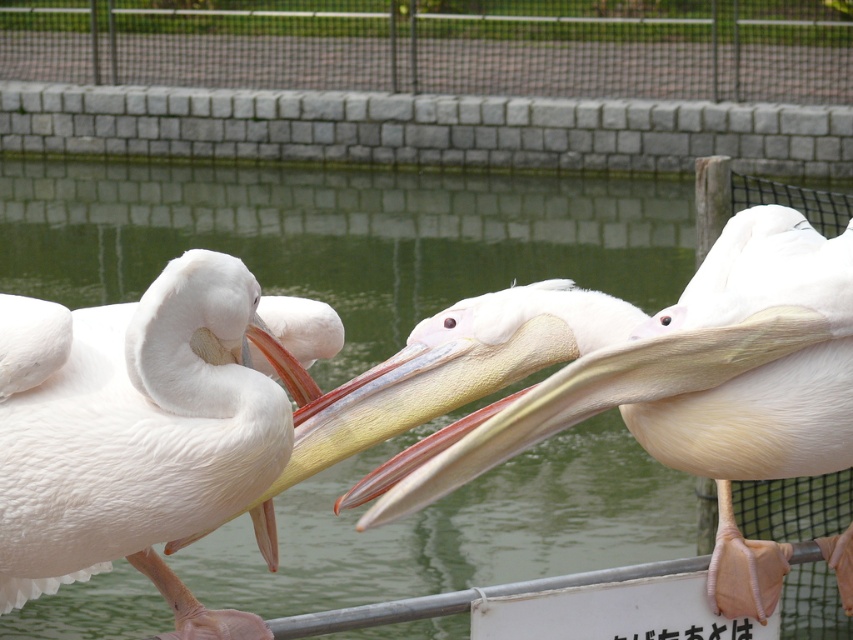
Question: From the image, what is the correct spatial relationship of white smooth pelican at center in relation to metal mesh fence at upper center?

Choices:
 (A) above
 (B) below

Answer: (B)

Question: Which point is closer to the camera?

Choices:
 (A) white feathered pelican at center
 (B) white smooth pelican at center
 (C) metal mesh fence at upper center

Answer: (A)

Question: Is white smooth pelican at center to the right of white feathered pelican at center from the viewer's perspective?

Choices:
 (A) yes
 (B) no

Answer: (A)

Question: Is the position of white feathered pelican at center more distant than that of metal mesh fence at upper center?

Choices:
 (A) no
 (B) yes

Answer: (A)

Question: Which point appears farthest from the camera in this image?

Choices:
 (A) (96, 337)
 (B) (776, 13)
 (C) (374, 376)

Answer: (B)

Question: Which object is the farthest from the white feathered pelican at center?

Choices:
 (A) white smooth pelican at center
 (B) metal mesh fence at upper center

Answer: (B)